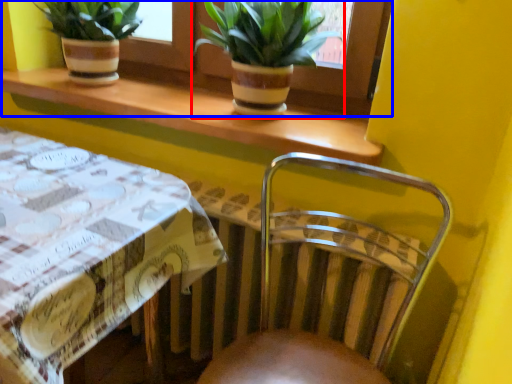
Question: Which point is closer to the camera, houseplant (highlighted by a red box) or window frame (highlighted by a blue box)?

Choices:
 (A) houseplant
 (B) window frame

Answer: (A)